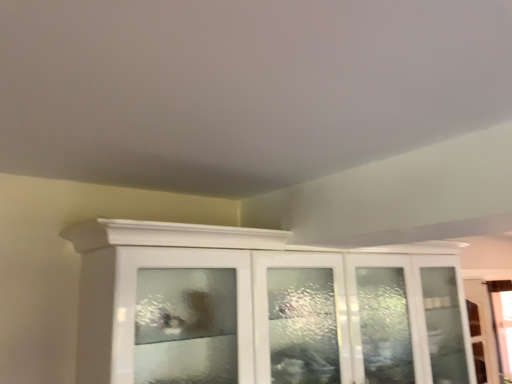
Image resolution: width=512 pixels, height=384 pixels. Find the location of `white frosted glass cabinet at center`. white frosted glass cabinet at center is located at coordinates (264, 308).

This screenshot has height=384, width=512. Describe the element at coordinates (264, 308) in the screenshot. I see `white frosted glass cabinet at center` at that location.

Identify the location of white frosted glass cabinet at center. This screenshot has height=384, width=512. (264, 308).